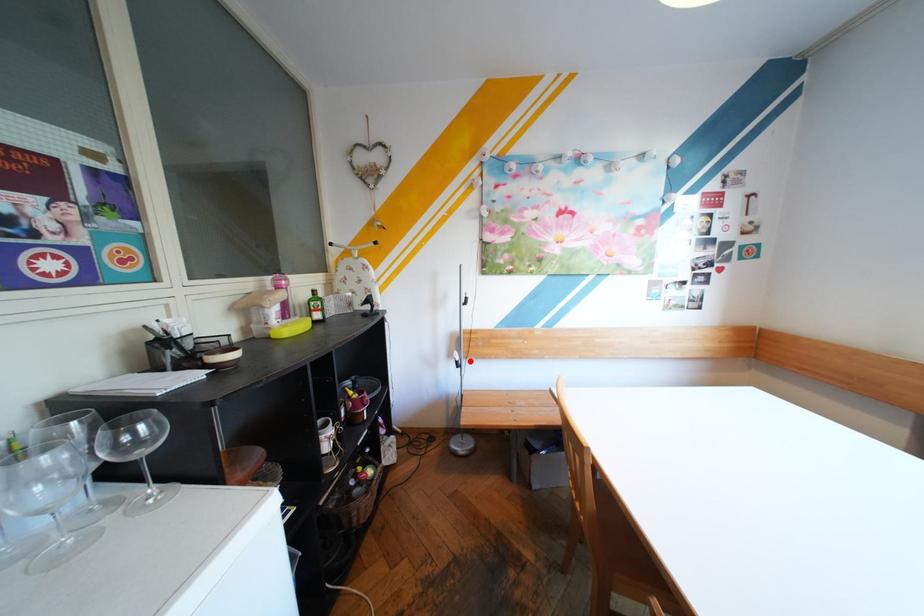
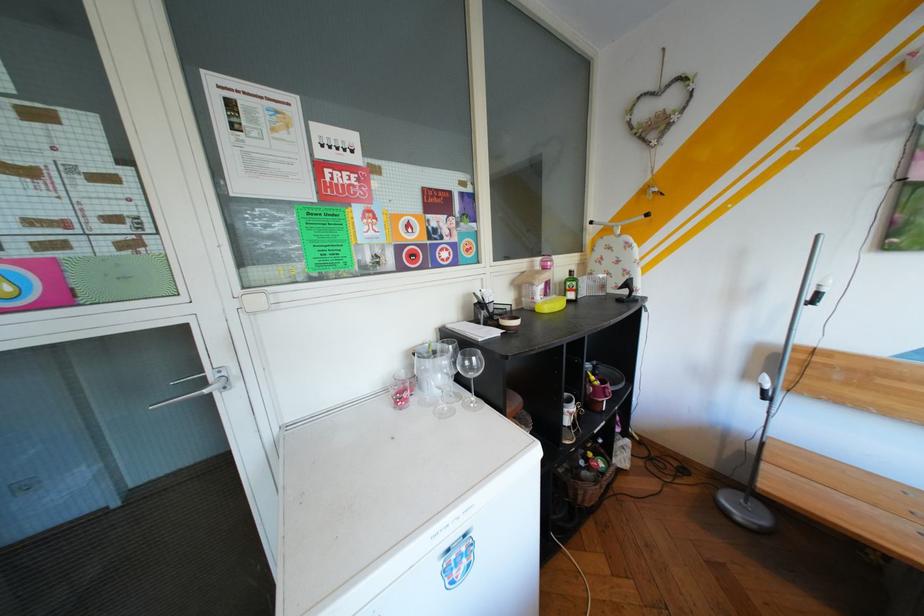
In the second image, find the point that corresponds to the highlighted location in the first image.

(776, 390)